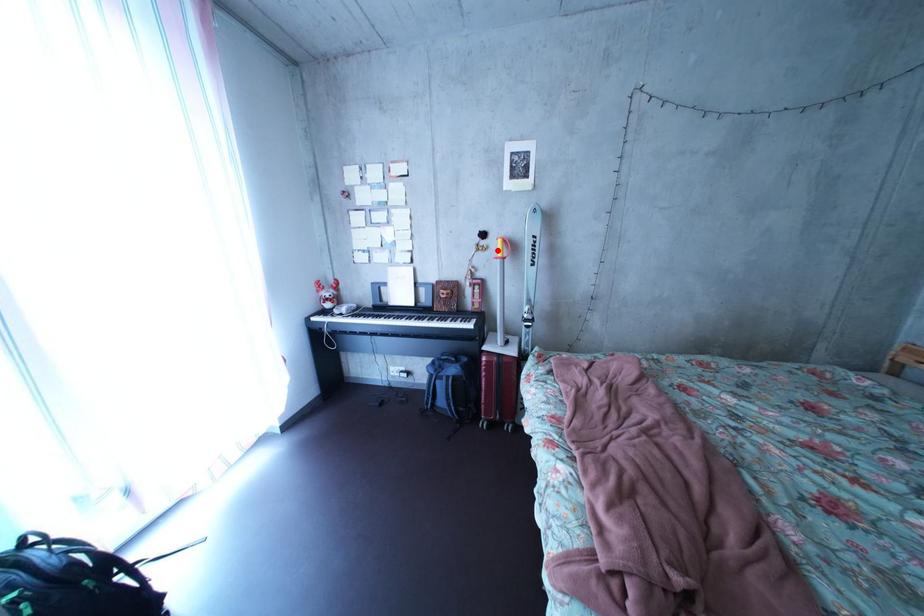
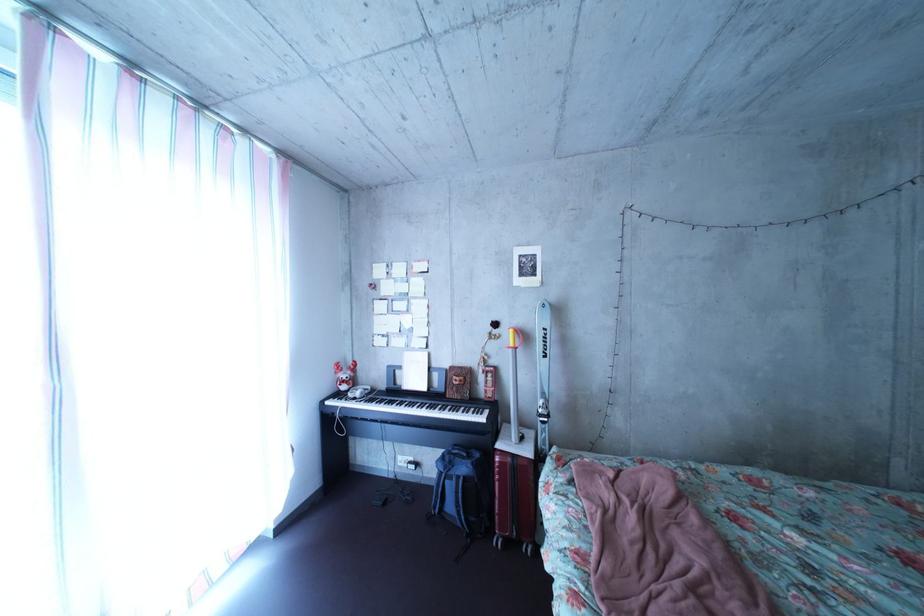
The point at the highlighted location is marked in the first image. Where is the corresponding point in the second image?

(509, 339)